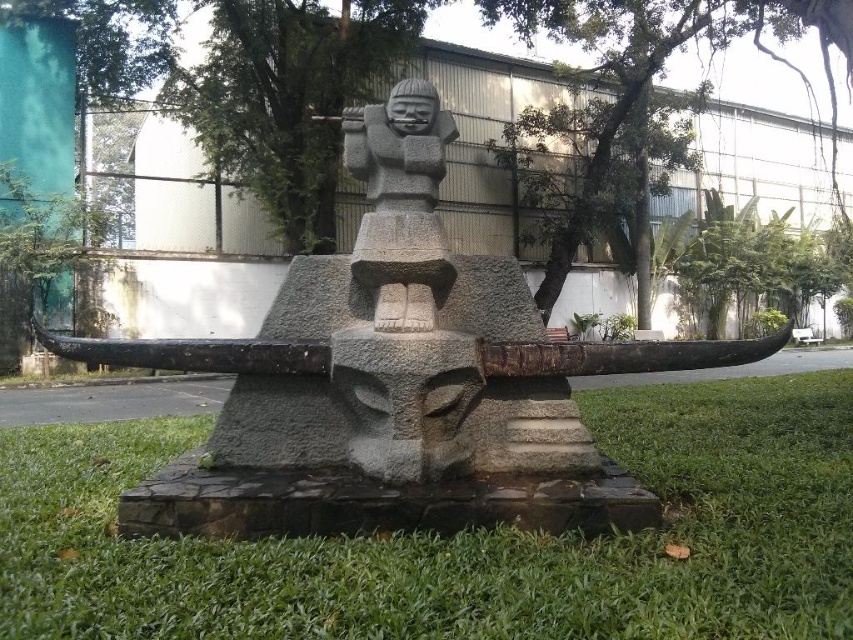
Who is more forward, (x=177, y=554) or (x=149, y=481)?

Point (x=177, y=554)

Who is lower down, green grass at center or gray stone statue at center?

Positioned lower is green grass at center.

Is point (262, 620) farther from viewer compared to point (224, 522)?

No, it is not.

The height and width of the screenshot is (640, 853). Identify the location of green grass at center. (463, 538).